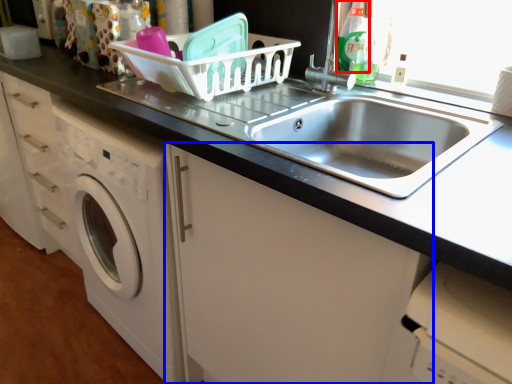
Question: Which object is further to the camera taking this photo, cleaning product (highlighted by a red box) or cabinetry (highlighted by a blue box)?

Choices:
 (A) cleaning product
 (B) cabinetry

Answer: (A)